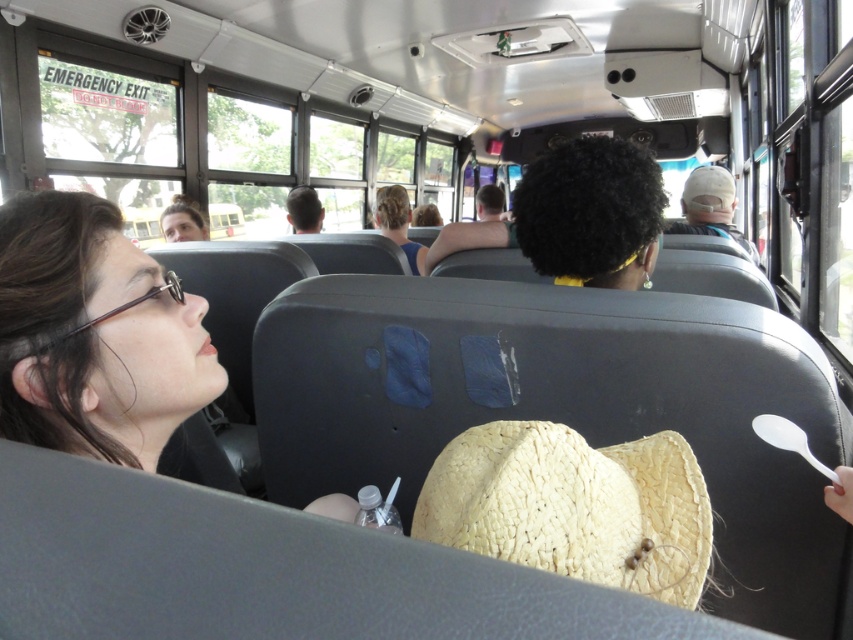
You are a passenger on a bus and need to place a 10 feet long item between the woven straw cowboy hat at center and the straw hat at upper center. Is there enough space between them to fit the item?

The distance between the woven straw cowboy hat at center and the straw hat at upper center is 8.55 feet, which is shorter than the 10 feet long item. Therefore, the item cannot fit between them.

You are a passenger on the bus and want to know if the point at coordinate (32, 433) is closer to you than the point at (720, 193). Can you determine this based on your position?

Yes, the point at coordinate (32, 433) is closer to you than the point at (720, 193).

You are a passenger on a bus and need to reach for your white plastic spoon at lower right without disturbing the straw hat at upper center. Is this possible?

The straw hat at upper center is positioned over the white plastic spoon at lower right, so reaching for the spoon might disturb the hat. Carefully move the hat aside first or retrieve the spoon cautiously to avoid contact.